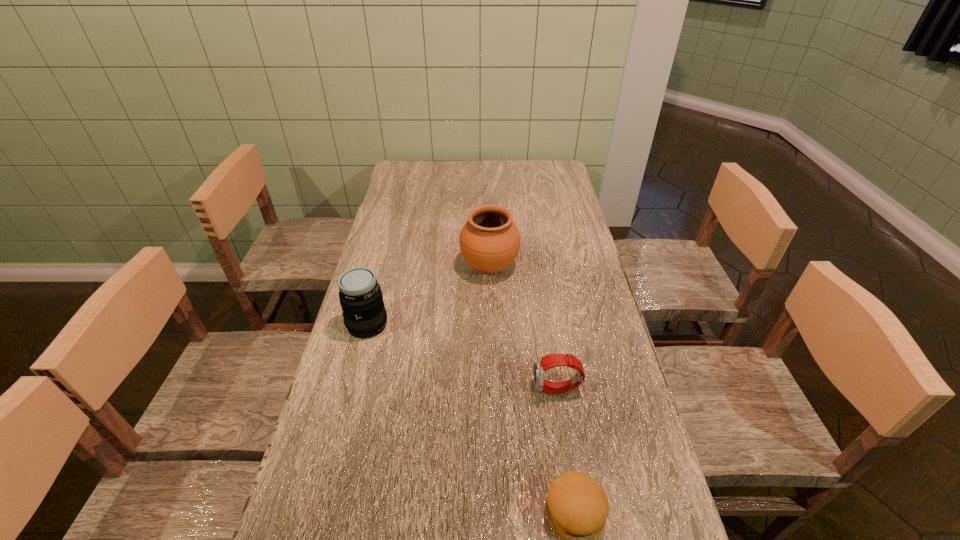
I want to click on the farthest object, so click(x=489, y=241).

This screenshot has height=540, width=960. I want to click on pottery, so click(489, 241).

This screenshot has height=540, width=960. What are the coordinates of `telephoto lens` in the screenshot? It's located at (360, 296).

I want to click on the second farthest object, so click(360, 296).

Where is `the third farthest object`? The height and width of the screenshot is (540, 960). the third farthest object is located at coordinates (541, 364).

The image size is (960, 540). I want to click on the third tallest object, so click(x=541, y=364).

Image resolution: width=960 pixels, height=540 pixels. I want to click on free region located on the left of the farthest object, so click(x=366, y=267).

What are the coordinates of `blank area located on the front of the leftmost object` in the screenshot? It's located at (345, 411).

Locate an element on the screen. The image size is (960, 540). vacant space located 0.120m on the face of the third tallest object is located at coordinates (485, 390).

In order to click on vacant space situated 0.170m on the face of the third tallest object in this screenshot , I will do click(x=465, y=390).